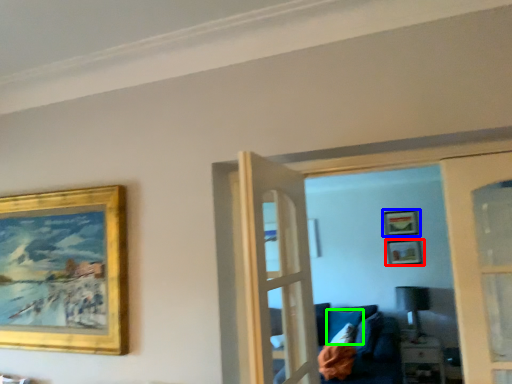
Question: Considering the real-world distances, which object is closest to picture frame (highlighted by a red box)? picture frame (highlighted by a blue box) or pillow (highlighted by a green box).

Choices:
 (A) picture frame
 (B) pillow

Answer: (A)